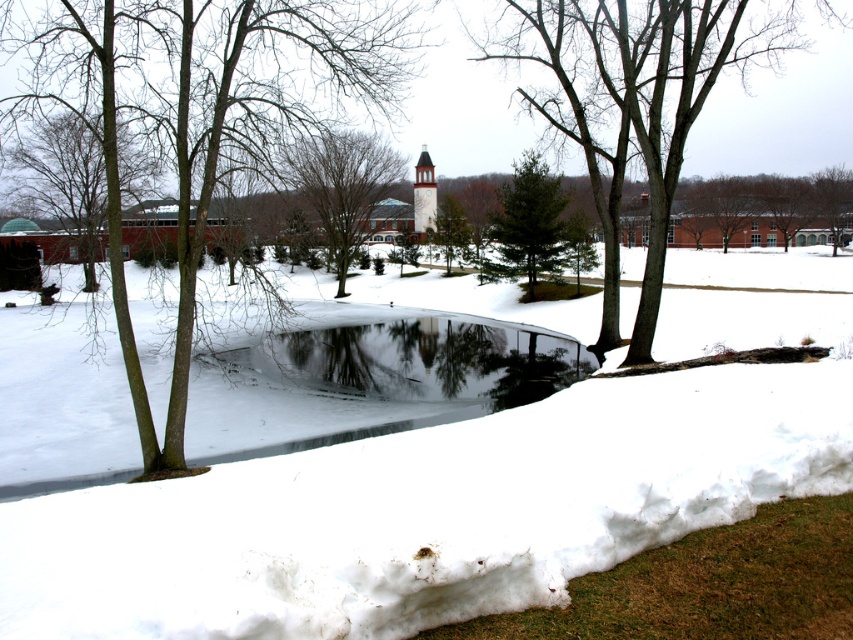
Question: Which is nearer to the brown bark tree at left?

Choices:
 (A) green leafy tree at center
 (B) brown textured tree at upper center
 (C) brown textured tree at upper right

Answer: (B)

Question: Does brown bark tree at left have a lesser width compared to green textured pine tree at center?

Choices:
 (A) no
 (B) yes

Answer: (A)

Question: Which of the following is the closest to the observer?

Choices:
 (A) green leafy tree at center
 (B) brown textured tree at upper center

Answer: (B)

Question: Which object appears closest to the camera in this image?

Choices:
 (A) green leafy tree at center
 (B) brown bark tree at left
 (C) green textured pine tree at center

Answer: (B)

Question: Does green matte tree at center have a larger size compared to green textured pine tree at center?

Choices:
 (A) no
 (B) yes

Answer: (B)

Question: Can you confirm if brown textured tree at left is positioned below green matte tree at center?

Choices:
 (A) yes
 (B) no

Answer: (B)